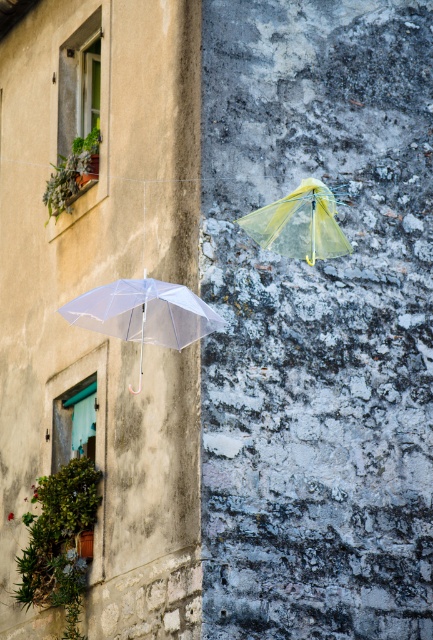
Who is positioned more to the right, transparent plastic umbrella at lower left or transparent nylon umbrella at center?

transparent nylon umbrella at center is more to the right.

Which is behind, point (113, 336) or point (328, 220)?

The point (328, 220) is more distant.

Locate an element on the screen. The width and height of the screenshot is (433, 640). transparent plastic umbrella at lower left is located at coordinates tap(144, 314).